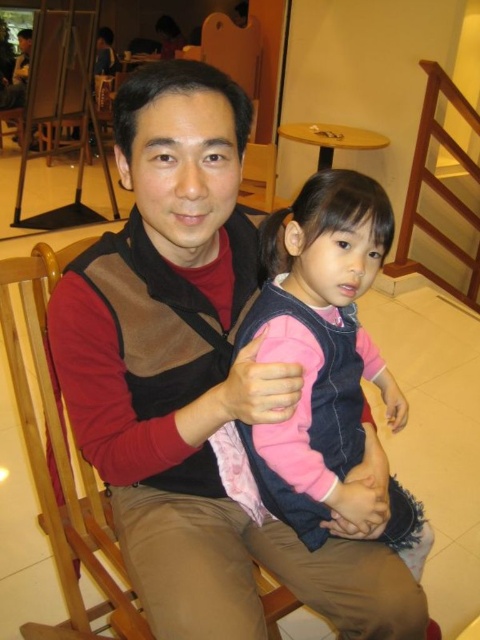
In the scene shown: Who is higher up, brown suede vest at center or pink fleece vest at center?

brown suede vest at center is above.

Locate an element on the screen. Image resolution: width=480 pixels, height=640 pixels. brown suede vest at center is located at coordinates (194, 380).